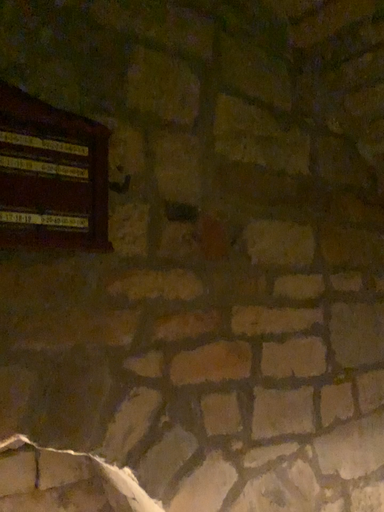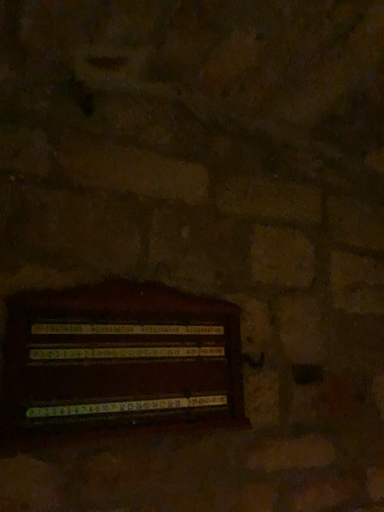
Question: How did the camera likely rotate when shooting the video?

Choices:
 (A) rotated downward
 (B) rotated upward

Answer: (B)